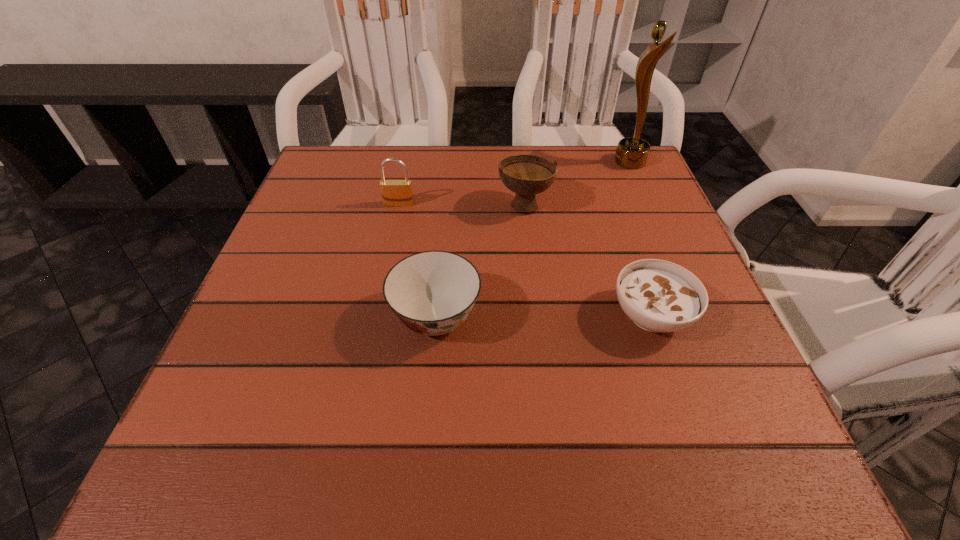
Identify the location of free point between the second shortest soup bowl and the tallest object. (533, 240).

The height and width of the screenshot is (540, 960). In order to click on vacant area that lies between the third object from right to left and the leftmost soup bowl in this screenshot , I will do `click(481, 261)`.

Locate an element on the screen. The width and height of the screenshot is (960, 540). free space that is in between the leftmost soup bowl and the farthest object is located at coordinates (533, 240).

The image size is (960, 540). What are the coordinates of `free space between the tallest object and the third object from left to right` in the screenshot? It's located at 578,183.

I want to click on empty space between the tallest object and the rightmost soup bowl, so click(640, 238).

Where is `the fourth closest object to the fourth tallest object`? the fourth closest object to the fourth tallest object is located at coordinates (632, 152).

Point out which object is positioned as the second nearest to the shortest object. Please provide its 2D coordinates. Your answer should be formatted as a tuple, i.e. [(x, y)], where the tuple contains the x and y coordinates of a point satisfying the conditions above.

[(432, 292)]

Where is `soup bowl that is the third closest to the award`? This screenshot has height=540, width=960. soup bowl that is the third closest to the award is located at coordinates (432, 292).

The image size is (960, 540). I want to click on soup bowl that is the second closest to the farthest soup bowl, so click(658, 296).

Locate an element on the screen. The width and height of the screenshot is (960, 540). vacant space that satisfies the following two spatial constraints: 1. on the back side of the tallest soup bowl; 2. on the left side of the second shortest object is located at coordinates (446, 204).